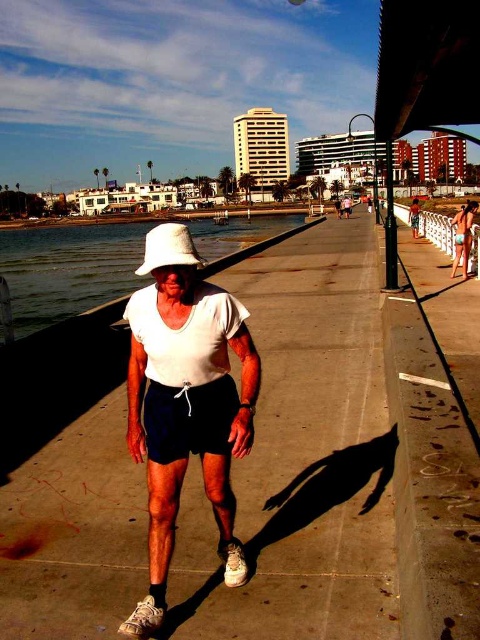
Does white matte hat at center have a greater height compared to clear water at center?

In fact, white matte hat at center may be shorter than clear water at center.

The width and height of the screenshot is (480, 640). I want to click on white matte hat at center, so click(x=186, y=403).

Who is more distant from viewer, (x=242, y=388) or (x=97, y=237)?

The point (x=97, y=237) is more distant.

Where is `white matte hat at center`? The height and width of the screenshot is (640, 480). white matte hat at center is located at coordinates (186, 403).

Can you confirm if clear water at center is positioned below white fabric cowboy hat at center?

No, clear water at center is not below white fabric cowboy hat at center.

Is point (132, 252) positioned before point (178, 237)?

No, it is behind (178, 237).

You are a GUI agent. You are given a task and a screenshot of the screen. Output one action in this format:
    pyautogui.click(x=<x>, y=<y>)
    Task: Click on the clear water at center
    The height and width of the screenshot is (640, 480).
    Given the screenshot: What is the action you would take?
    pyautogui.click(x=69, y=269)

Who is more distant from viewer, (298,225) or (348,205)?

The point (298,225) is behind.

Is clear water at center positioned in front of white cotton shirt at center?

Yes, it is in front of white cotton shirt at center.

Who is more distant from viewer, (31, 285) or (349, 204)?

The point (349, 204) is more distant.

Find the location of a particular element. This screenshot has width=480, height=640. clear water at center is located at coordinates (69, 269).